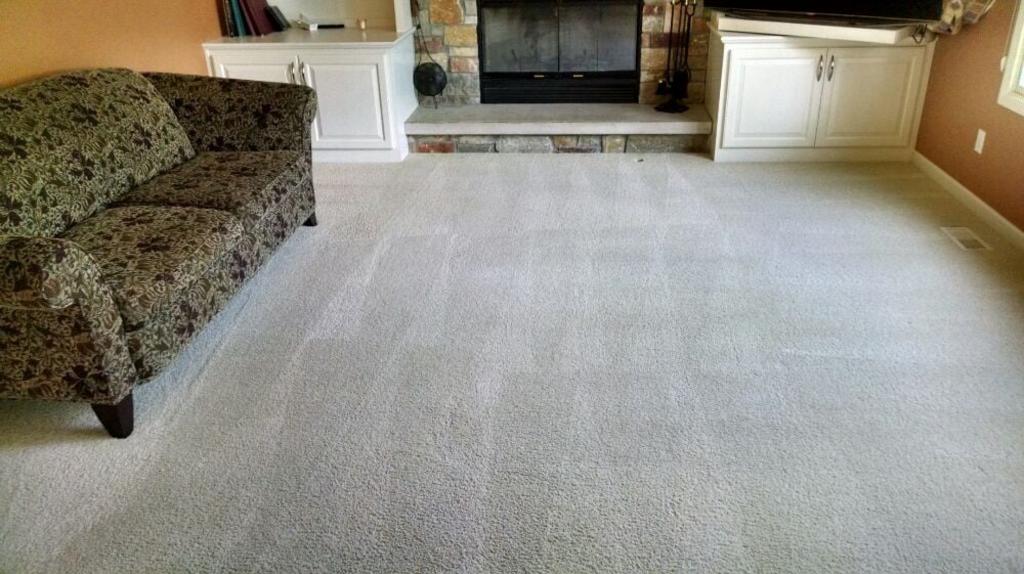
Locate an element on the screen. drawer is located at coordinates (356, 100).